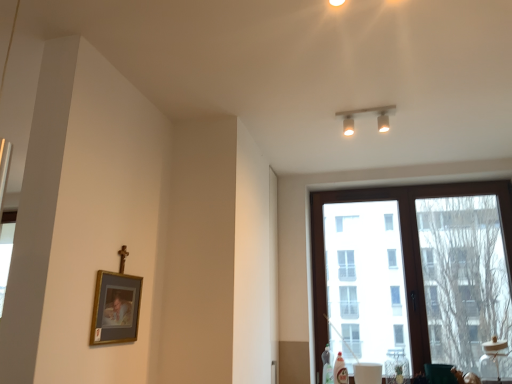
Question: Is brown wooden window at right outside matte white track lights at upper center?

Choices:
 (A) yes
 (B) no

Answer: (A)

Question: Is matte white track lights at upper center surrounded by brown wooden window at right?

Choices:
 (A) yes
 (B) no

Answer: (B)

Question: Can you confirm if brown wooden window at right is thinner than matte white track lights at upper center?

Choices:
 (A) no
 (B) yes

Answer: (A)

Question: From the image's perspective, is brown wooden window at right under matte white track lights at upper center?

Choices:
 (A) yes
 (B) no

Answer: (A)

Question: Is brown wooden window at right wider than matte white track lights at upper center?

Choices:
 (A) no
 (B) yes

Answer: (B)

Question: Is the position of brown wooden window at right more distant than that of matte white track lights at upper center?

Choices:
 (A) no
 (B) yes

Answer: (B)

Question: Is matte white track lights at upper center positioned far away from brown wooden window at right?

Choices:
 (A) yes
 (B) no

Answer: (A)

Question: Does matte white track lights at upper center have a smaller size compared to brown wooden window at right?

Choices:
 (A) no
 (B) yes

Answer: (B)

Question: From a real-world perspective, is matte white track lights at upper center located beneath brown wooden window at right?

Choices:
 (A) no
 (B) yes

Answer: (A)

Question: Is matte white track lights at upper center located outside brown wooden window at right?

Choices:
 (A) no
 (B) yes

Answer: (B)

Question: From the image's perspective, is matte white track lights at upper center on top of brown wooden window at right?

Choices:
 (A) yes
 (B) no

Answer: (A)

Question: From the image's perspective, is matte white track lights at upper center located beneath brown wooden window at right?

Choices:
 (A) no
 (B) yes

Answer: (A)

Question: From a real-world perspective, is matte white track lights at upper center physically below gold-framed picture at lower left?

Choices:
 (A) yes
 (B) no

Answer: (B)